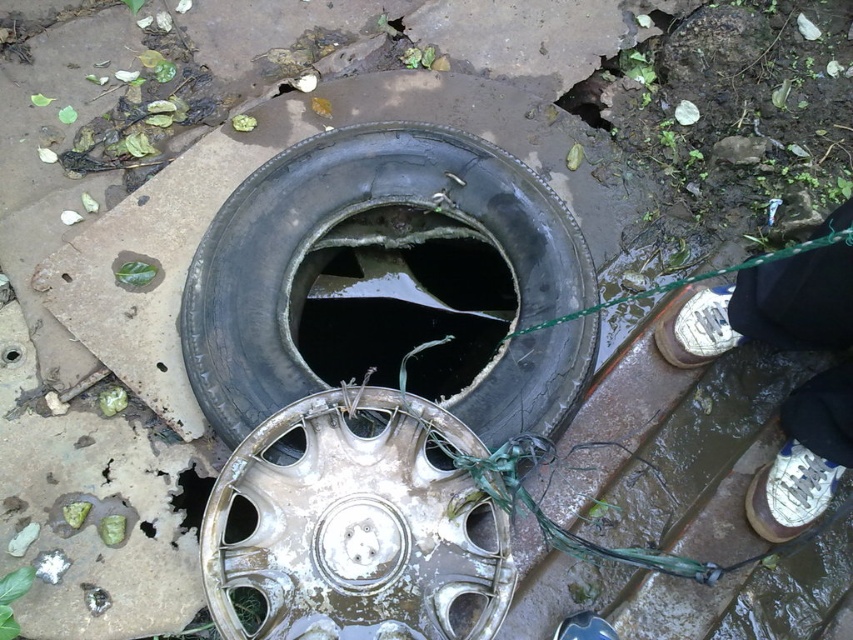
You are standing at the center of the scene and want to pick up the white leather shoe at right without stepping on the black rubber tire at center. Is the path to the shoe clear?

The black rubber tire at center is to the left of the white leather shoe at right, so there is a clear path to the shoe as long as you step around the tire.

You are a delivery person who needs to place a package between the black rubber tire at center and the white leather sneakers at lower right. Is there enough space to fit the package, which is 24 inches long?

The distance between the black rubber tire at center and the white leather sneakers at lower right is 23.10 inches. The package is 24 inches long, so it won not fit between them.